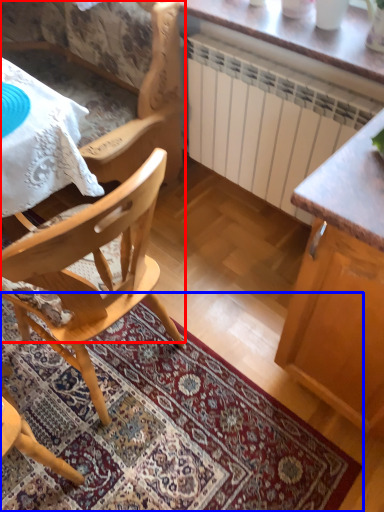
Question: Which object is closer to the camera taking this photo, chair (highlighted by a red box) or mat (highlighted by a blue box)?

Choices:
 (A) chair
 (B) mat

Answer: (B)